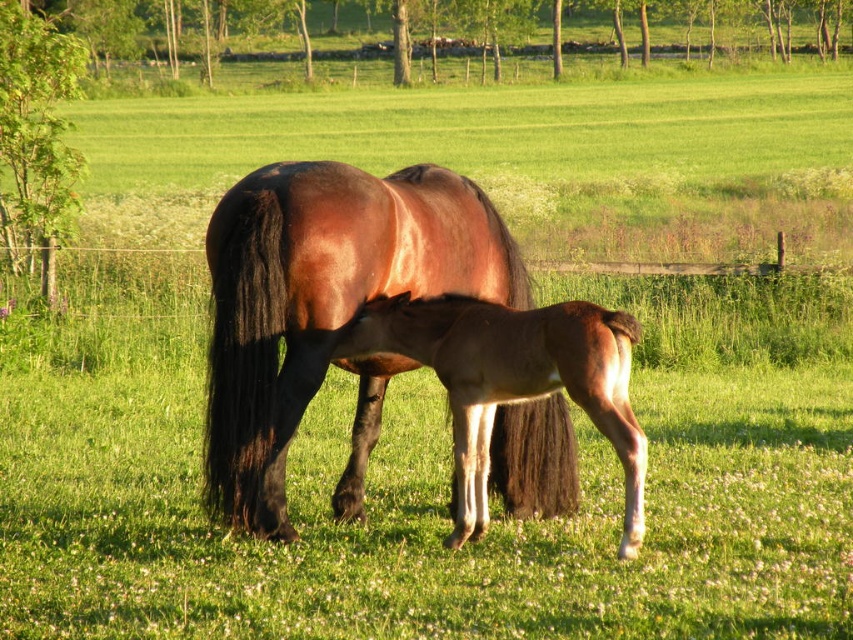
Question: Which point is closer to the camera?

Choices:
 (A) (407, 173)
 (B) (561, 365)

Answer: (B)

Question: From the image, what is the correct spatial relationship of shiny brown horse at center in relation to brown glossy foal at center?

Choices:
 (A) below
 (B) above

Answer: (B)

Question: Can you confirm if shiny brown horse at center is positioned above brown glossy foal at center?

Choices:
 (A) no
 (B) yes

Answer: (B)

Question: Which object appears farthest from the camera in this image?

Choices:
 (A) brown glossy foal at center
 (B) shiny brown horse at center

Answer: (A)

Question: Which of the following is the closest to the observer?

Choices:
 (A) brown glossy foal at center
 (B) shiny brown horse at center

Answer: (B)

Question: Can you confirm if shiny brown horse at center is thinner than brown glossy foal at center?

Choices:
 (A) no
 (B) yes

Answer: (A)